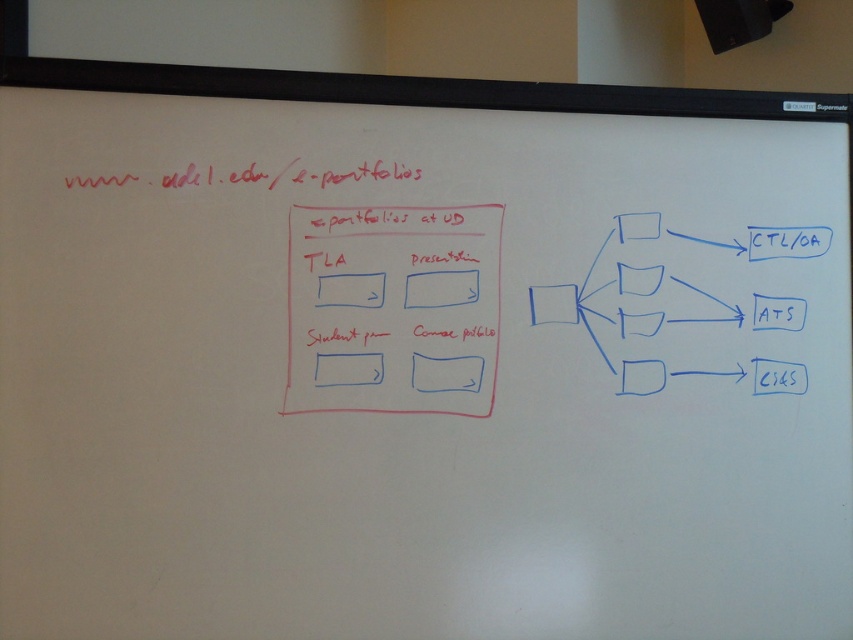
Does white matte presentation at center come in front of white paper at center?

That is False.

Where is `white matte presentation at center`? white matte presentation at center is located at coordinates click(x=440, y=289).

Measure the distance between point (416, 376) and camera.

Point (416, 376) is 4.75 feet away from camera.

Does white paper at center have a smaller size compared to white matte square at center?

Incorrect, white paper at center is not smaller in size than white matte square at center.

The height and width of the screenshot is (640, 853). What do you see at coordinates (445, 372) in the screenshot? I see `white paper at center` at bounding box center [445, 372].

At what (x,y) coordinates should I click in order to perform the action: click on white paper at center. Please return your answer as a coordinate pair (x, y). The height and width of the screenshot is (640, 853). Looking at the image, I should click on (445, 372).

Can you confirm if white matte presentation at center is shorter than white matte square at center?

No.

Can you confirm if white matte presentation at center is positioned below white matte square at center?

No.

Is point (468, 294) farther from viewer compared to point (329, 301)?

Yes, point (468, 294) is farther from viewer.

Locate an element on the screen. This screenshot has height=640, width=853. white matte presentation at center is located at coordinates (440, 289).